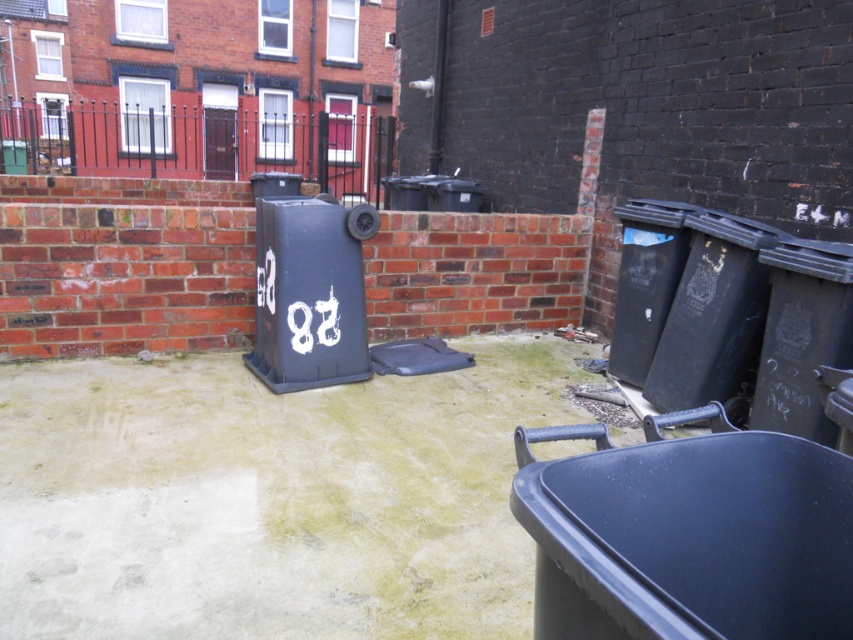
You are a sanitation worker needing to move a heavy object from the matte black bin at lower right to the matte black recycling bin at center. Given that the minimum safe distance for operating equipment is 3 meters, is this path safe to proceed with the transfer?

The distance between the matte black bin at lower right and the matte black recycling bin at center is 2.67 meters, which is less than the required 3 meters for safe operation. Therefore, proceeding with the transfer would not be safe.

You are a delivery person approaching the alleyway and need to place a package near the closest bin. Which bin should you choose between the matte black bin at lower right and the matte black recycling bin at center?

The matte black bin at lower right is closer to the viewer than the matte black recycling bin at center, so you should choose the matte black bin at lower right to place the package.